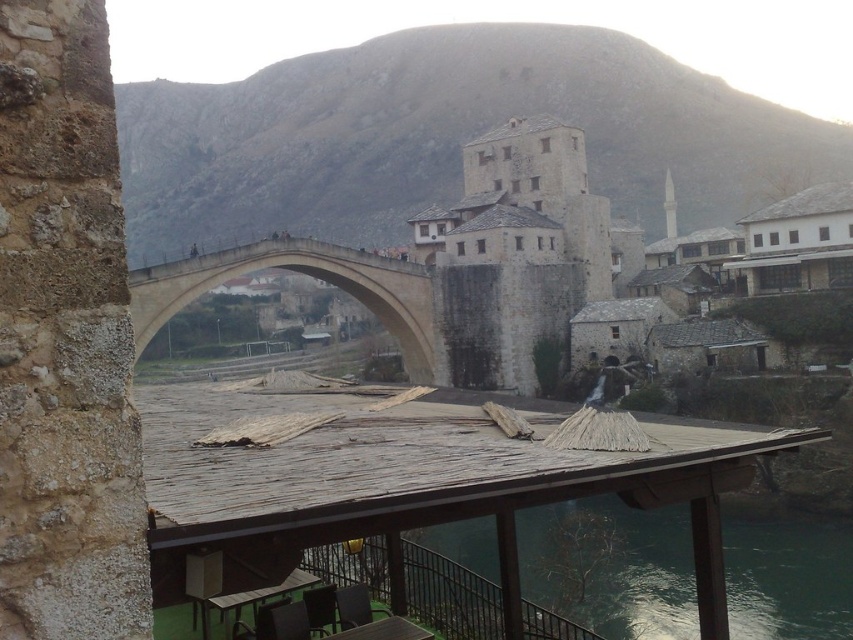
Measure the distance from beige stone bridge at center to white stone tower at center.

The distance of beige stone bridge at center from white stone tower at center is 96.10 meters.

Between beige stone bridge at center and white stone tower at center, which one appears on the left side from the viewer's perspective?

beige stone bridge at center

Who is more distant from viewer, (187, 262) or (674, 214)?

Point (674, 214)

I want to click on beige stone bridge at center, so click(x=306, y=275).

Does greenish water at lower center come behind beige stone bridge at center?

That is True.

Can you confirm if greenish water at lower center is positioned to the left of beige stone bridge at center?

Incorrect, greenish water at lower center is not on the left side of beige stone bridge at center.

Measure the distance between point (764, 536) and camera.

Point (764, 536) and camera are 69.57 meters apart.

I want to click on greenish water at lower center, so click(x=611, y=566).

Is greenish water at lower center closer to camera compared to white stone tower at center?

Yes.

Which is in front, point (767, 628) or point (669, 232)?

Point (767, 628)

Locate an element on the screen. greenish water at lower center is located at coordinates (611, 566).